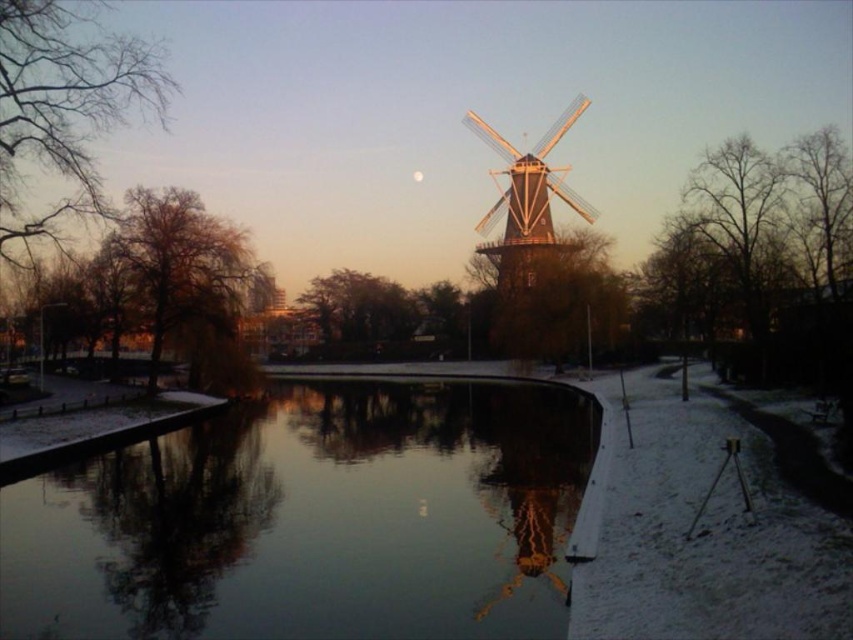
You are an architect designing a new bridge that needs to be 10 meters tall. You observe the smooth water at center and the wooden windmill at center in the winter scene. Based on their heights, will the bridge be taller than both structures combined?

The smooth water at center is shorter than the wooden windmill at center. However, without specific height measurements for either structure, it is impossible to determine if the bridge will be taller than their combined height.

You are an architect designing a miniature model of this winter scene. You need to ensure that the smooth water at center and the wooden windmill at center are proportionate. Based on the scene, which object should you make wider in your model?

The smooth water at center should be made wider in the model since its width surpasses that of the wooden windmill at center according to the description.